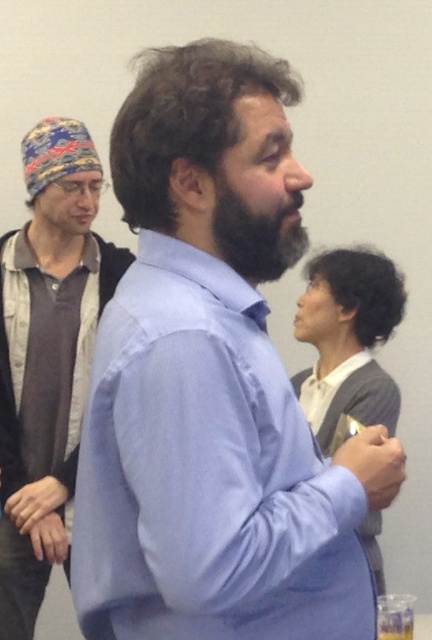
Question: Is light blue shirt at center wider than matte blue shirt at center?

Choices:
 (A) no
 (B) yes

Answer: (B)

Question: Which object is the farthest from the dark brown fuzzy beard at center?

Choices:
 (A) light blue shirt at center
 (B) matte blue shirt at center

Answer: (B)

Question: Which point is farther to the camera?

Choices:
 (A) matte blue shirt at center
 (B) light blue shirt at center
 (C) dark brown fuzzy beard at center

Answer: (A)

Question: Can you confirm if matte blue shirt at center is smaller than dark brown fuzzy beard at center?

Choices:
 (A) yes
 (B) no

Answer: (B)

Question: Which object is closer to the camera taking this photo?

Choices:
 (A) matte blue shirt at center
 (B) dark brown fuzzy beard at center

Answer: (B)

Question: Does light blue shirt at center appear over matte blue shirt at center?

Choices:
 (A) no
 (B) yes

Answer: (B)